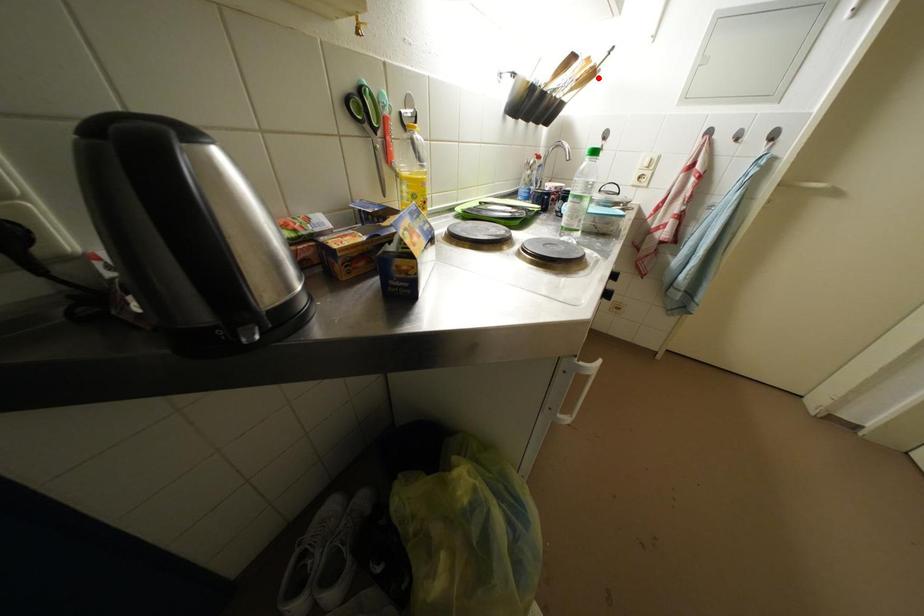
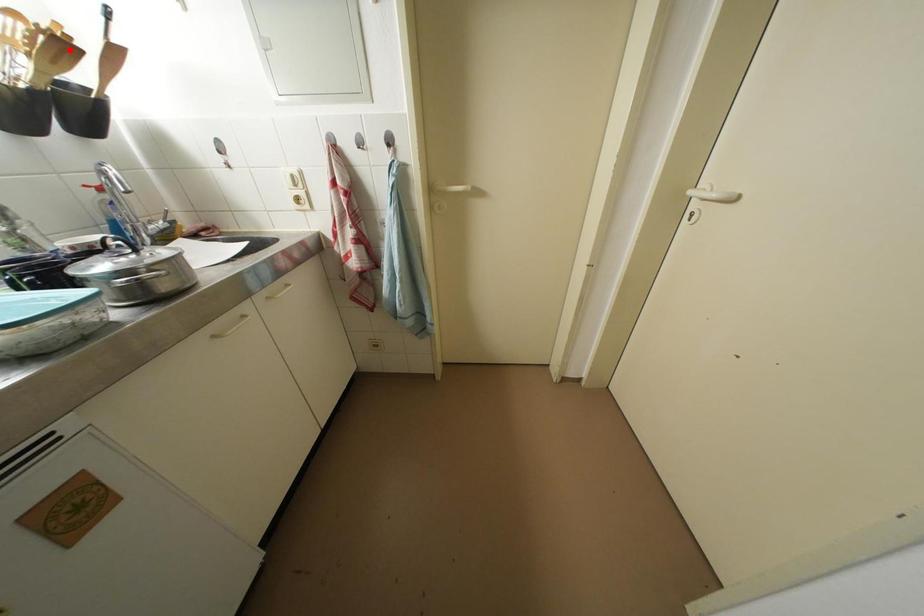
I am providing you with two images of the same scene from different viewpoints. A red point is marked on the first image and another point is marked on the second image. Does the point marked in image1 correspond to the same location as the one in image2?

Yes